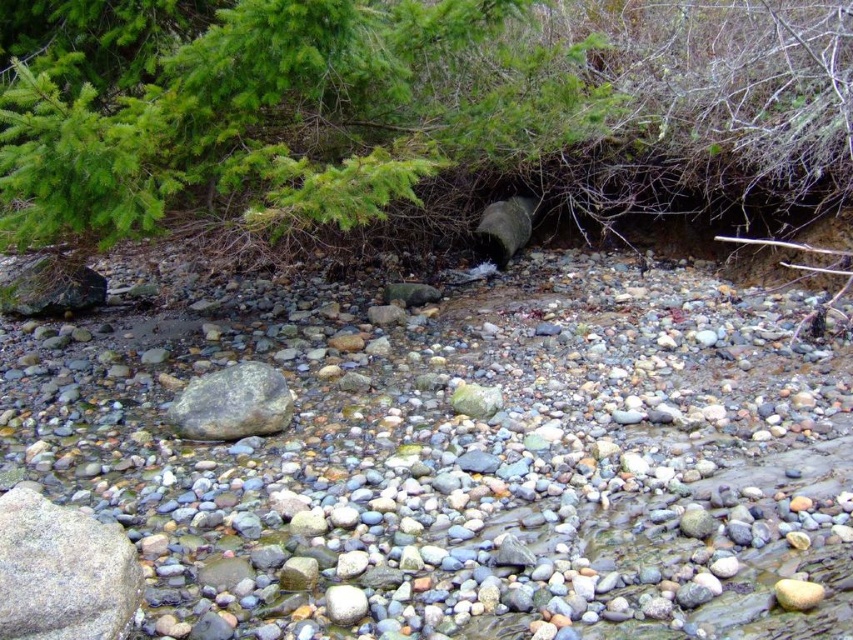
Can you confirm if green matte tree at upper center is positioned to the right of gray smooth rock at center?

Yes, green matte tree at upper center is to the right of gray smooth rock at center.

Is green matte tree at upper center in front of gray smooth rock at center?

Yes, green matte tree at upper center is closer to the viewer.

At what (x,y) coordinates should I click in order to perform the action: click on green matte tree at upper center. Please return your answer as a coordinate pair (x, y). This screenshot has width=853, height=640. Looking at the image, I should click on (289, 116).

Which is below, smooth gray rock at center or green matte tree at upper center?

smooth gray rock at center is below.

Is smooth gray rock at center smaller than green matte tree at upper center?

Actually, smooth gray rock at center might be larger than green matte tree at upper center.

Is point (518, 404) farther from camera compared to point (552, 113)?

No, (518, 404) is in front of (552, 113).

Identify the location of smooth gray rock at center. This screenshot has height=640, width=853. (461, 458).

Who is shorter, smooth gray rock at center or gray smooth rock at center?

Standing shorter between the two is gray smooth rock at center.

Is smooth gray rock at center to the right of gray smooth rock at center from the viewer's perspective?

Indeed, smooth gray rock at center is positioned on the right side of gray smooth rock at center.

You are a GUI agent. You are given a task and a screenshot of the screen. Output one action in this format:
    pyautogui.click(x=<x>, y=<y>)
    Task: Click on the smooth gray rock at center
    The image size is (853, 640).
    Given the screenshot: What is the action you would take?
    pyautogui.click(x=461, y=458)